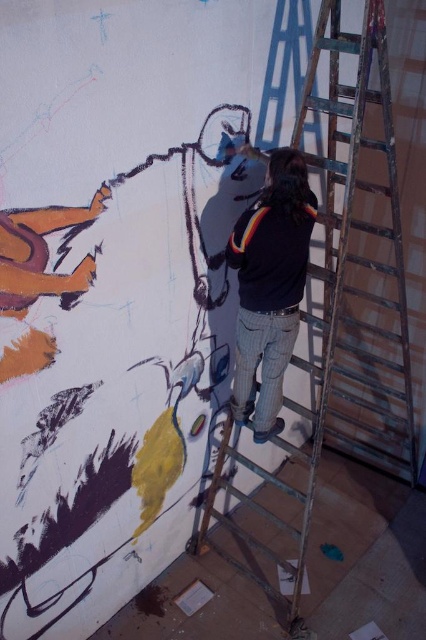
You are standing 10 feet away from the wall where the artist is painting. The artist is working on a point marked as point (x=377, y=275). Can you reach that point with a 12 foot long pole?

The distance of point (x=377, y=275) from viewer is 12.06 feet. Since you are standing 10 feet away from the wall, the total distance to the point is 10 feet plus the distance from the wall to the point. However, the given distance of 12.06 feet is from the viewer to the point directly, so if your pole is 12 feet long, it would be slightly too short to reach the point which is 12.06 feet away.

You are a painter who wants to reach the top of the metallic silver ladder at center to touch up the mural. However, you notice the black sweater at center might be in the way. Is the ladder accessible for climbing?

The metallic silver ladder at center is in front of the black sweater at center, so the ladder is not blocked by the sweater and can be climbed safely.

You are an art inspector checking the mural. You notice the metallic silver ladder at center and the black sweater at center. How far apart are these two items?

The metallic silver ladder at center is 20.70 inches away from the black sweater at center.